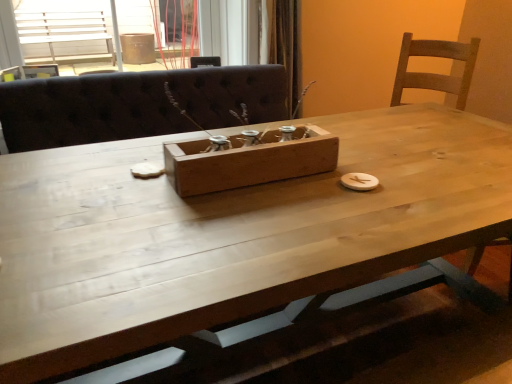
Question: Is wooden box at center taller or shorter than wooden frame at upper center?

Choices:
 (A) tall
 (B) short

Answer: (B)

Question: Is wooden box at center inside or outside of wooden frame at upper center?

Choices:
 (A) outside
 (B) inside

Answer: (A)

Question: Which object is positioned farthest from the natural wood table at center?

Choices:
 (A) wooden frame at upper center
 (B) wooden box at center

Answer: (A)

Question: Estimate the real-world distances between objects in this image. Which object is closer to the natural wood table at center?

Choices:
 (A) wooden box at center
 (B) wooden frame at upper center

Answer: (A)